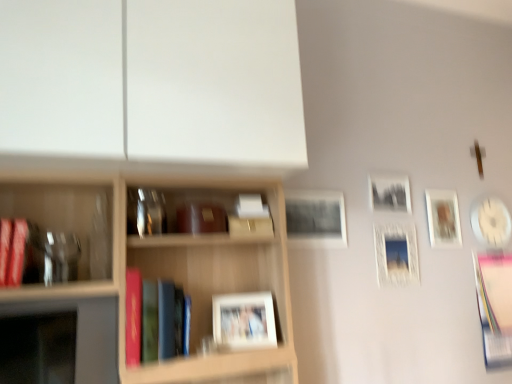
Locate an element on the screen. The height and width of the screenshot is (384, 512). blank space above pink paper book at right, the 1th book in the right-to-left sequence (from a real-world perspective) is located at coordinates (496, 246).